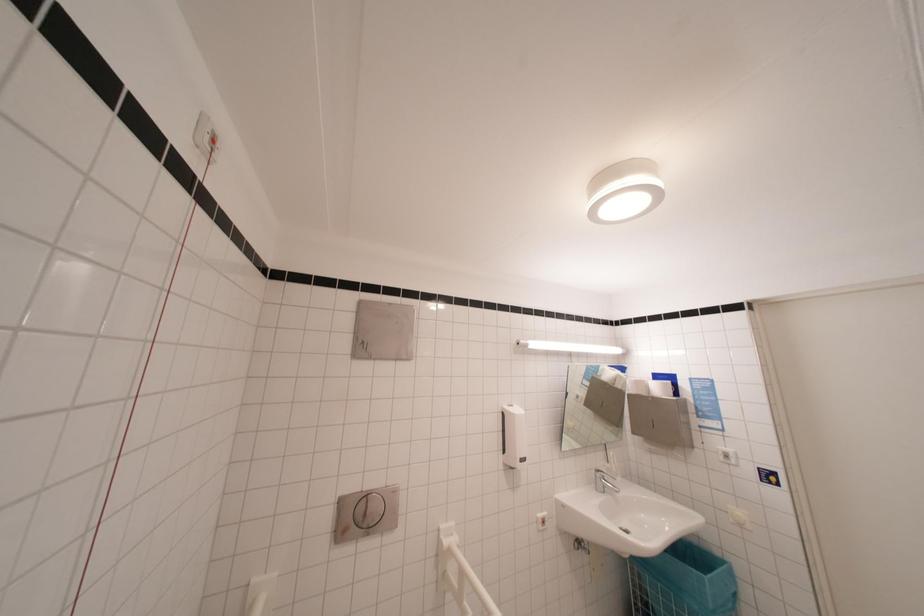
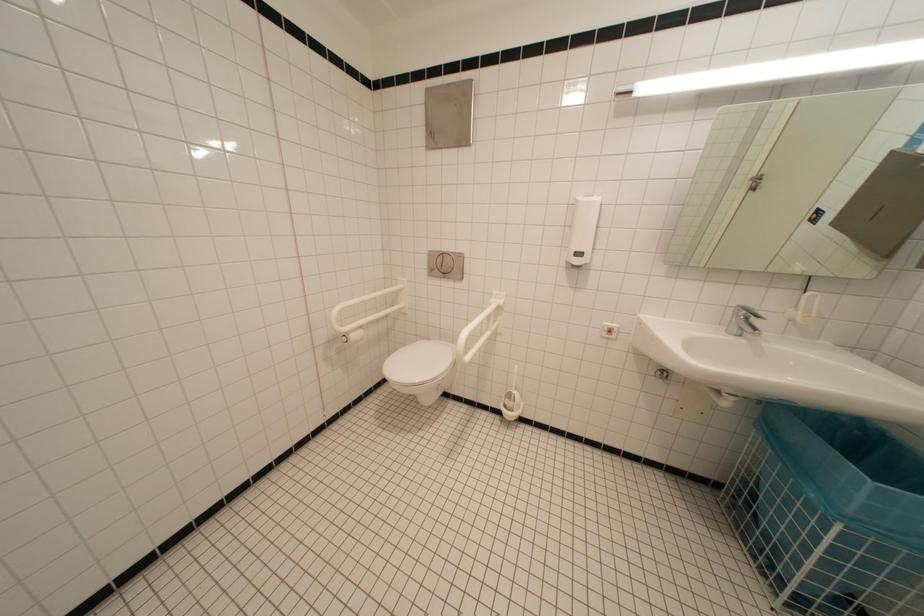
Based on the continuous images, in which direction is the camera rotating?

The camera's rotation is toward left-down.